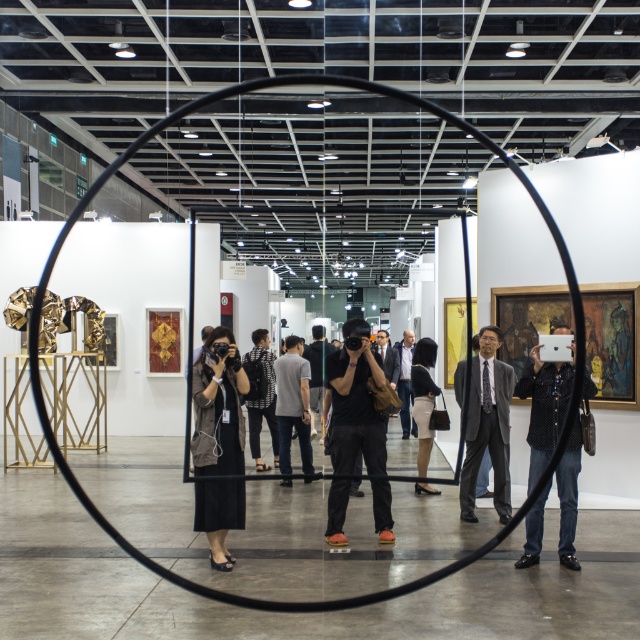
Question: Does gray suit at center have a lesser width compared to dark gray fabric jacket at center?

Choices:
 (A) yes
 (B) no

Answer: (A)

Question: Estimate the real-world distances between objects in this image. Which object is farther from the black matte camera at center?

Choices:
 (A) gray suit at center
 (B) black textured jacket at center
 (C) black matte dress at center

Answer: (B)

Question: Is black matte dress at center above black matte camera at center?

Choices:
 (A) no
 (B) yes

Answer: (B)

Question: Among these points, which one is farthest from the camera?

Choices:
 (A) (314, 394)
 (B) (337, 531)

Answer: (A)

Question: Based on their relative distances, which object is nearer to the matte black camera at center?

Choices:
 (A) black textured jacket at center
 (B) dark gray fabric jacket at center

Answer: (B)

Question: Is black matte dress at center to the right of black textured jacket at center from the viewer's perspective?

Choices:
 (A) no
 (B) yes

Answer: (A)